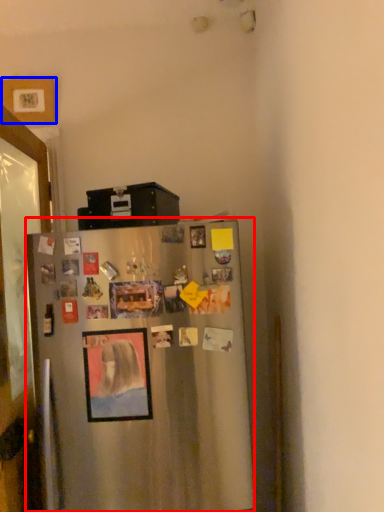
Question: Which object appears farthest to the camera in this image, refrigerator (highlighted by a red box) or picture frame (highlighted by a blue box)?

Choices:
 (A) refrigerator
 (B) picture frame

Answer: (B)